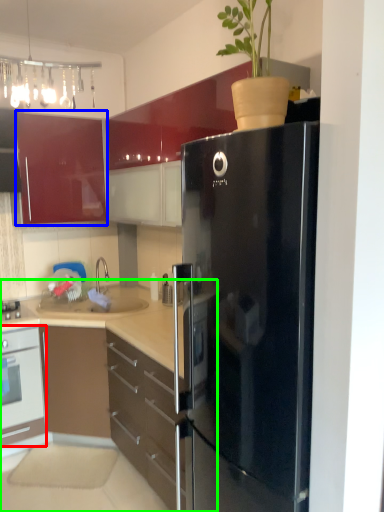
Question: Estimate the real-world distances between objects in this image. Which object is closer to oven (highlighted by a red box), cabinetry (highlighted by a blue box) or cabinetry (highlighted by a green box)?

Choices:
 (A) cabinetry
 (B) cabinetry

Answer: (B)